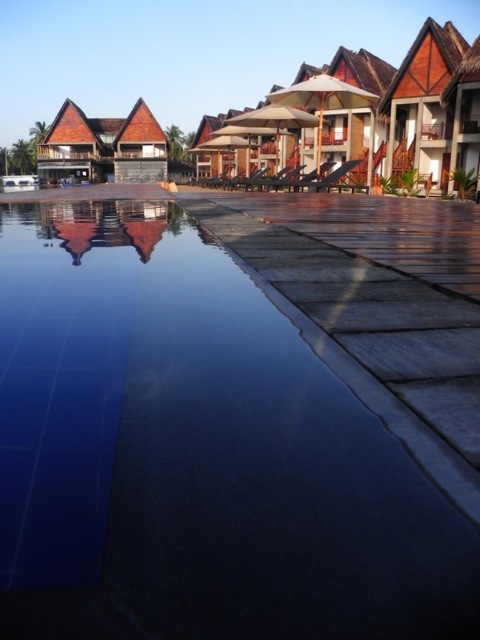
Is wooden hut at upper right positioned in front of wooden thatched hut at left?

Yes, it is in front of wooden thatched hut at left.

Which is behind, point (455, 104) or point (131, 177)?

The point (131, 177) is behind.

The image size is (480, 640). I want to click on wooden hut at upper right, so click(x=433, y=108).

Is point (157, 160) behind point (476, 131)?

Yes.

How far apart are wooden thatched hut at left and wooden thatched hut at upper right?

They are 32.83 meters apart.

Where is `wooden thatched hut at left`? The image size is (480, 640). wooden thatched hut at left is located at coordinates (103, 147).

Image resolution: width=480 pixels, height=640 pixels. Find the location of `wooden thatched hut at left`. wooden thatched hut at left is located at coordinates (103, 147).

From the picture: Who is lower down, wooden lounge chairs at upper center or wooden thatched hut at upper right?

Positioned lower is wooden thatched hut at upper right.

Looking at this image, does wooden lounge chairs at upper center have a larger size compared to wooden thatched hut at upper right?

Correct, wooden lounge chairs at upper center is larger in size than wooden thatched hut at upper right.

Is point (422, 35) farther from viewer compared to point (452, 177)?

Yes, point (422, 35) is farther from viewer.

Identify the location of wooden lounge chairs at upper center. (406, 108).